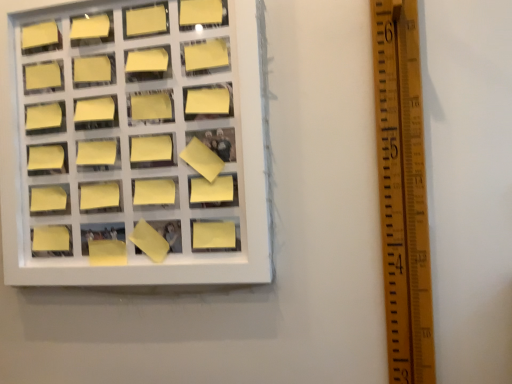
Question: From a real-world perspective, is yellow matte sticky note at center-left, which is the 9th square in top-to-bottom order, above or below white plastic frame at upper left?

Choices:
 (A) above
 (B) below

Answer: (B)

Question: From the image's perspective, is yellow matte sticky note at center-left, the third square in the bottom-to-top sequence, located above or below white plastic frame at upper left?

Choices:
 (A) above
 (B) below

Answer: (B)

Question: Which object is the farthest from the yellow matte sticky note at upper left, marked as the 7th square in a top-to-bottom arrangement?

Choices:
 (A) yellow matte sticky note at center-left, the second square positioned from the bottom
 (B) yellow matte sticky note at upper left, the sixth square viewed from the top
 (C) yellow matte sticky note at upper left, arranged as the 8th square when ordered from the bottom
 (D) yellow matte sticky note at lower left, placed as the first square when sorted from bottom to top
 (E) wooden ruler at right

Answer: (E)

Question: Considering the real-world distances, which object is closest to the yellow matte sticky note at upper center, the ninth square in the bottom-to-top sequence?

Choices:
 (A) yellow matte sticky note at center, which is the fifth square in top-to-bottom order
 (B) yellow matte sticky note at upper left, which is the 8th square in top-to-bottom order
 (C) yellow matte sticky note at upper center, the eleventh square positioned from the bottom
 (D) yellow matte sticky note at upper left, placed as the fifth square when sorted from bottom to top
 (E) yellow matte sticky note at upper left, acting as the second square starting from the top

Answer: (C)